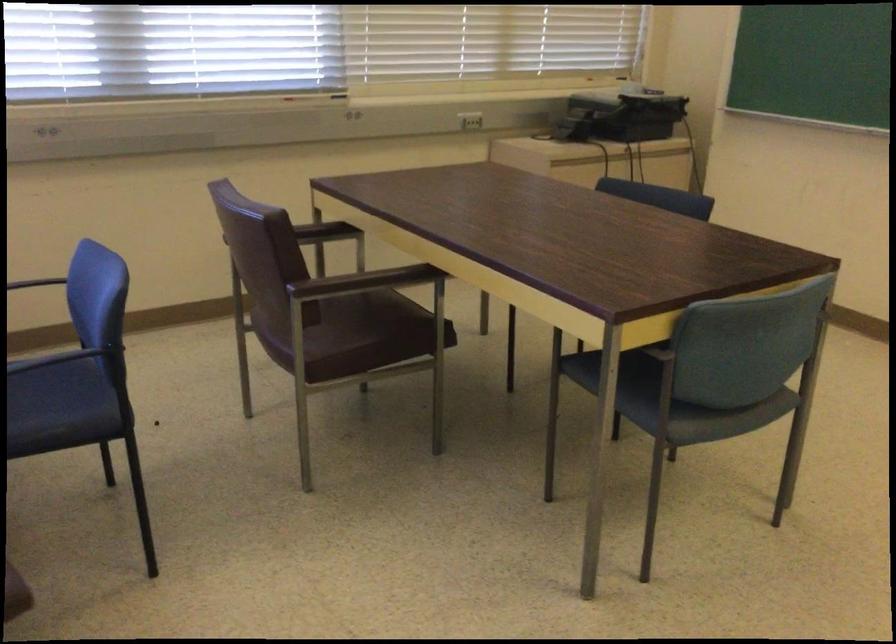
The image size is (896, 644). Identify the location of brown chair sitting surface. (371, 330).